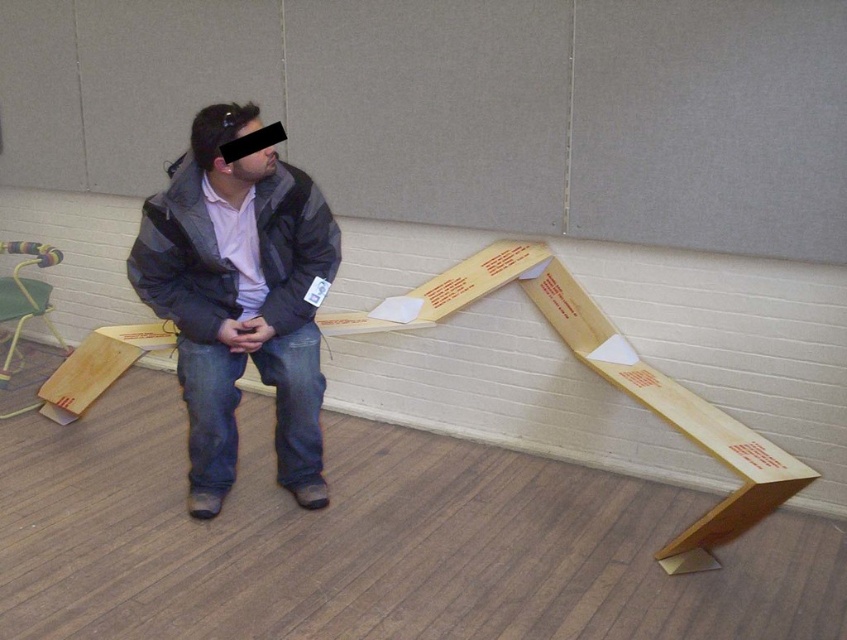
Question: Is dark gray jacket at center to the right of multicolored plastic stool at left from the viewer's perspective?

Choices:
 (A) yes
 (B) no

Answer: (A)

Question: Does dark gray jacket at center come behind striped fabric jacket at center?

Choices:
 (A) yes
 (B) no

Answer: (B)

Question: Which point is farther from the camera taking this photo?

Choices:
 (A) (311, 195)
 (B) (237, 344)
 (C) (42, 308)

Answer: (C)

Question: Is dark gray jacket at center wider than striped fabric jacket at center?

Choices:
 (A) yes
 (B) no

Answer: (B)

Question: Which of the following is the closest to the observer?

Choices:
 (A) (176, 218)
 (B) (250, 285)
 (C) (4, 294)

Answer: (A)

Question: Which object is farther from the camera taking this photo?

Choices:
 (A) multicolored plastic stool at left
 (B) dark gray jacket at center
 (C) striped fabric jacket at center

Answer: (A)